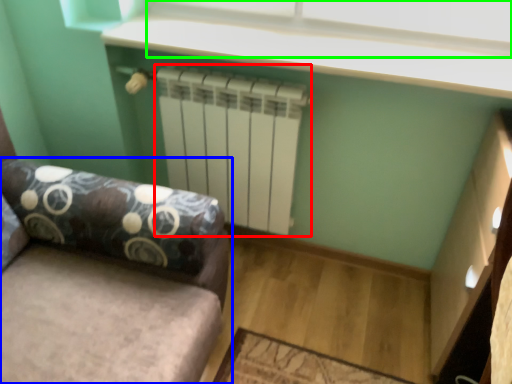
Question: Which object is the closest to the radiator (highlighted by a red box)? Choose among these: studio couch (highlighted by a blue box) or window screen (highlighted by a green box).

Choices:
 (A) studio couch
 (B) window screen

Answer: (B)